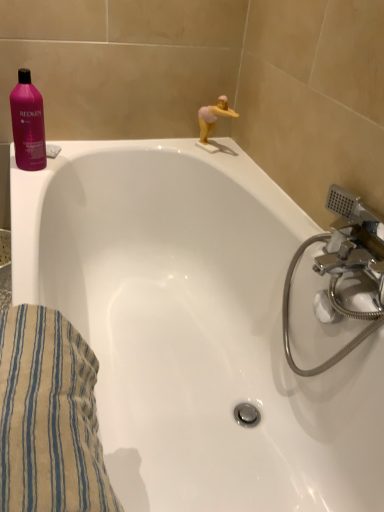
Image resolution: width=384 pixels, height=512 pixels. Find the location of `vacant area in front of pink rubber duck at upper right`. vacant area in front of pink rubber duck at upper right is located at coordinates (232, 164).